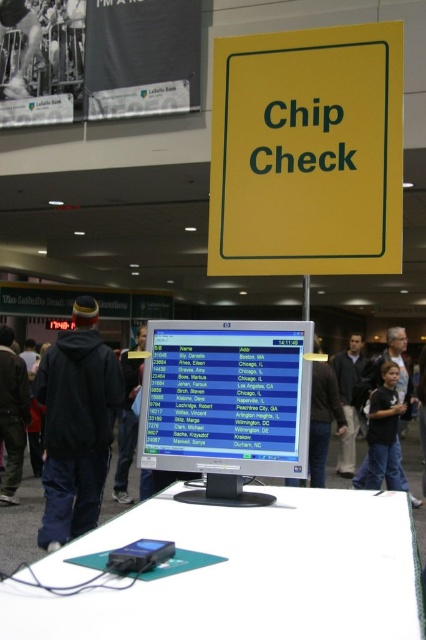
Question: Is dark blue jeans at lower right to the right of dark blue hoodie at center from the viewer's perspective?

Choices:
 (A) yes
 (B) no

Answer: (B)

Question: Which point is closer to the camera?

Choices:
 (A) (0, 417)
 (B) (423, 432)
 (C) (69, 397)

Answer: (C)

Question: Does black hoodie at center appear under black fabric shirt at center?

Choices:
 (A) no
 (B) yes

Answer: (A)

Question: Which point appears farthest from the camera in this image?

Choices:
 (A) (89, 300)
 (B) (417, 502)
 (C) (425, 419)

Answer: (B)

Question: In this image, where is black hoodie at center located relative to black fabric pants at lower left?

Choices:
 (A) below
 (B) above

Answer: (B)

Question: Considering the real-world distances, which object is closest to the black fabric pants at lower left?

Choices:
 (A) black hoodie at center
 (B) matte black monitor at center

Answer: (A)